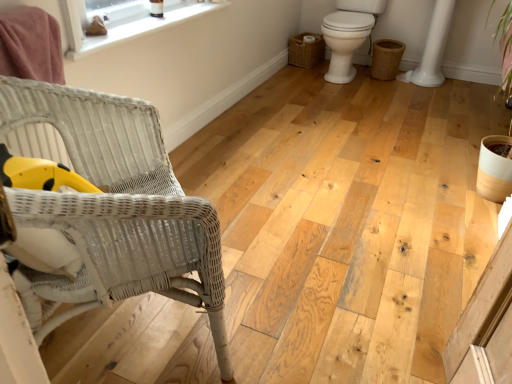
Where is `free space in front of white glossy toilet at right`? This screenshot has height=384, width=512. free space in front of white glossy toilet at right is located at coordinates (351, 101).